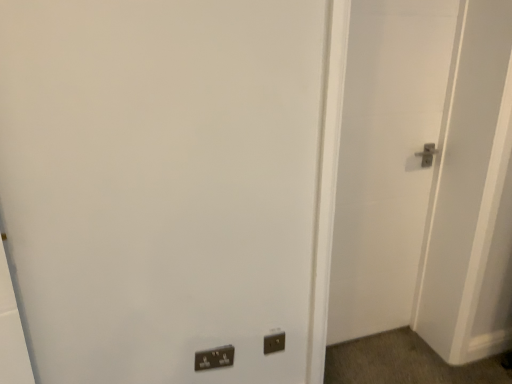
Describe the element at coordinates (214, 358) in the screenshot. The height and width of the screenshot is (384, 512). I see `matte black switch at lower center` at that location.

Find the location of a particular element. This screenshot has height=384, width=512. white matte door at right is located at coordinates (386, 159).

Locate an element on the screen. The image size is (512, 384). matte black switch at lower center is located at coordinates (214, 358).

Which object is closer to the camera taking this photo, matte black switch at lower center or white matte door at right?

Positioned in front is white matte door at right.

You are a GUI agent. You are given a task and a screenshot of the screen. Output one action in this format:
    pyautogui.click(x=<x>, y=<y>)
    Task: Click on the light switch below the white matte door at right (from the image's perspective)
    Image resolution: width=512 pixels, height=384 pixels.
    Given the screenshot: What is the action you would take?
    pyautogui.click(x=214, y=358)

Is there a large distance between matte black switch at lower center and white matte door at right?

Absolutely, matte black switch at lower center is distant from white matte door at right.

Is white matte door at right completely or partially outside of black plastic electric outlet at lower center?

That's correct, white matte door at right is outside of black plastic electric outlet at lower center.

From a real-world perspective, is white matte door at right physically below black plastic electric outlet at lower center?

Actually, white matte door at right is physically above black plastic electric outlet at lower center in the real world.

Looking at this image, which object is further away from the camera taking this photo, white matte door at right or black plastic electric outlet at lower center?

Positioned behind is black plastic electric outlet at lower center.

Is white matte door at right oriented away from black plastic electric outlet at lower center?

No.

Is matte black switch at lower center positioned in front of black plastic electric outlet at lower center?

Yes.

From the image's perspective, between matte black switch at lower center and black plastic electric outlet at lower center, which one is located above?

black plastic electric outlet at lower center.

Considering the relative positions of matte black switch at lower center and black plastic electric outlet at lower center in the image provided, is matte black switch at lower center to the left of black plastic electric outlet at lower center from the viewer's perspective?

Yes, matte black switch at lower center is to the left of black plastic electric outlet at lower center.

Are matte black switch at lower center and black plastic electric outlet at lower center making contact?

They are not placed beside each other.

Based on the photo, between black plastic electric outlet at lower center and white matte door at right, which one has less height?

With less height is black plastic electric outlet at lower center.

Consider the image. In the image, is black plastic electric outlet at lower center on the left side or the right side of white matte door at right?

From the image, it's evident that black plastic electric outlet at lower center is to the left of white matte door at right.

Does black plastic electric outlet at lower center have a smaller size compared to white matte door at right?

Correct, black plastic electric outlet at lower center occupies less space than white matte door at right.

Is black plastic electric outlet at lower center far from white matte door at right?

black plastic electric outlet at lower center is near white matte door at right, not far away.

Does point (356, 92) come closer to viewer compared to point (200, 370)?

No, it is not.

From the image's perspective, between white matte door at right and matte black switch at lower center, which one is located above?

white matte door at right.

Which is correct: white matte door at right is inside matte black switch at lower center, or outside of it?

white matte door at right is located beyond the bounds of matte black switch at lower center.

Consider the image. Who is taller, white matte door at right or matte black switch at lower center?

white matte door at right is taller.

Is black plastic electric outlet at lower center far away from matte black switch at lower center?

black plastic electric outlet at lower center is near matte black switch at lower center, not far away.

Considering the sizes of objects black plastic electric outlet at lower center and matte black switch at lower center in the image provided, who is wider, black plastic electric outlet at lower center or matte black switch at lower center?

With larger width is matte black switch at lower center.

Considering the relative sizes of black plastic electric outlet at lower center and matte black switch at lower center in the image provided, is black plastic electric outlet at lower center shorter than matte black switch at lower center?

Indeed, black plastic electric outlet at lower center has a lesser height compared to matte black switch at lower center.

Does black plastic electric outlet at lower center appear on the left side of matte black switch at lower center?

Incorrect, black plastic electric outlet at lower center is not on the left side of matte black switch at lower center.

You are a GUI agent. You are given a task and a screenshot of the screen. Output one action in this format:
    pyautogui.click(x=<x>, y=<y>)
    Task: Click on the light switch on the left of white matte door at right
    Image resolution: width=512 pixels, height=384 pixels.
    Given the screenshot: What is the action you would take?
    pyautogui.click(x=214, y=358)

Locate an element on the screen. The image size is (512, 384). electric outlet below the white matte door at right (from the image's perspective) is located at coordinates (274, 343).

Which object lies further to the anchor point black plastic electric outlet at lower center, white matte door at right or matte black switch at lower center?

white matte door at right is further to black plastic electric outlet at lower center.

Considering their positions, is black plastic electric outlet at lower center positioned closer to white matte door at right than matte black switch at lower center?

The object closer to white matte door at right is black plastic electric outlet at lower center.

Based on their spatial positions, is white matte door at right or black plastic electric outlet at lower center further from matte black switch at lower center?

The object further to matte black switch at lower center is white matte door at right.

Considering their positions, is black plastic electric outlet at lower center positioned further to matte black switch at lower center than white matte door at right?

white matte door at right.

Considering their positions, is matte black switch at lower center positioned closer to black plastic electric outlet at lower center than white matte door at right?

matte black switch at lower center.

When comparing their distances from white matte door at right, does matte black switch at lower center or black plastic electric outlet at lower center seem further?

matte black switch at lower center is further to white matte door at right.

Find the location of a particular element. This screenshot has height=384, width=512. electric outlet situated between matte black switch at lower center and white matte door at right from left to right is located at coordinates (274, 343).